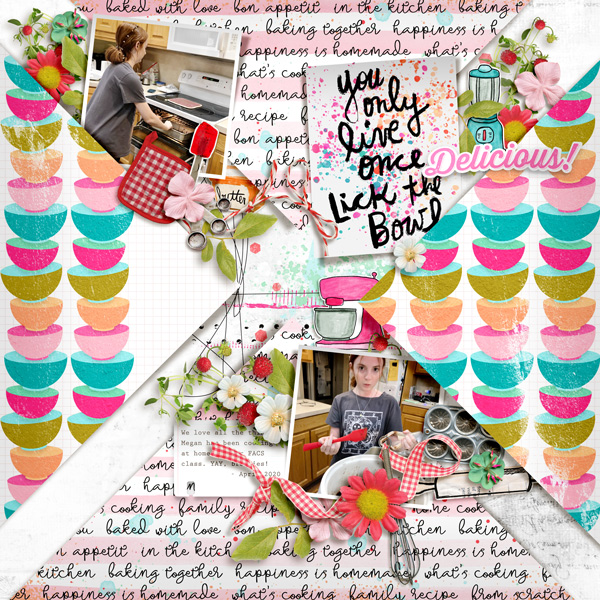
Find the location of a particular element. The image size is (600, 600). pink bowls is located at coordinates (505, 405), (564, 404), (500, 400), (505, 253), (560, 260), (105, 260), (44, 259).